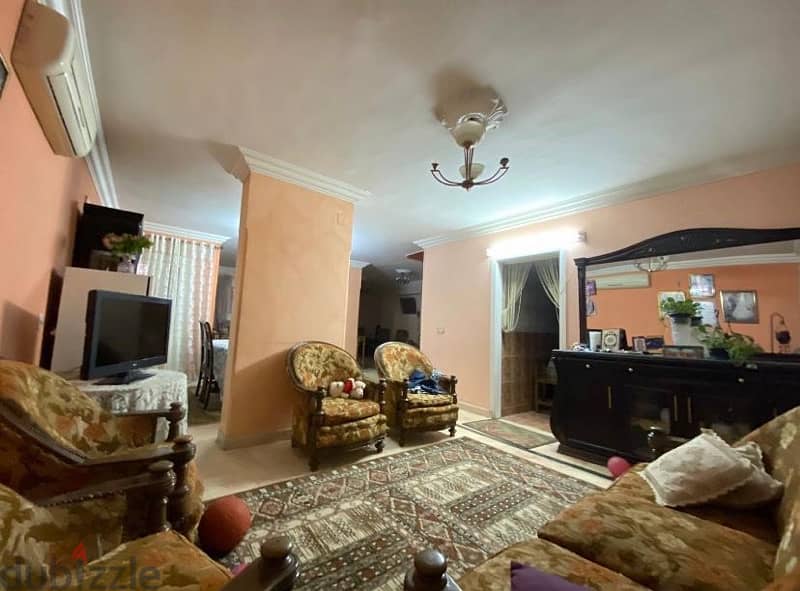
Locate an element on the screen. rugs is located at coordinates (446, 527), (520, 436).